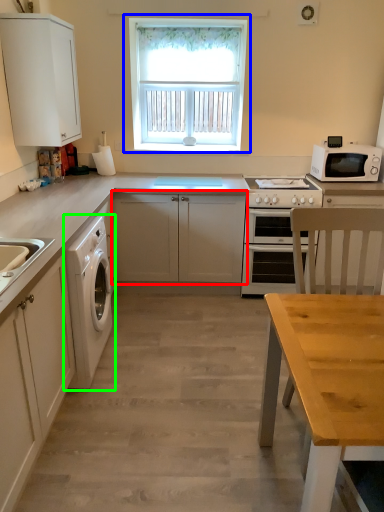
Question: Which object is positioned farthest from cabinetry (highlighted by a red box)? Select from window (highlighted by a blue box) and washing machine (highlighted by a green box).

Choices:
 (A) window
 (B) washing machine

Answer: (A)